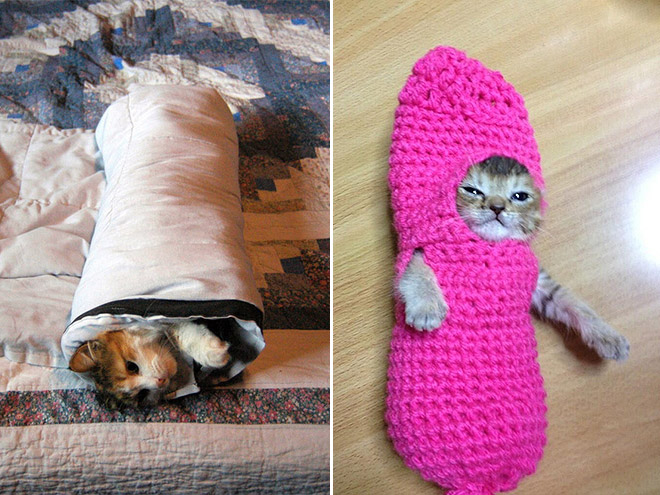
Find the location of a particular element. This screenshot has width=660, height=495. table is located at coordinates (612, 146).